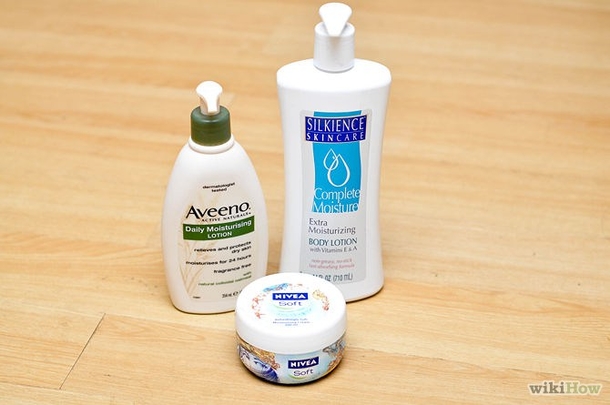
The width and height of the screenshot is (610, 405). I want to click on wood surface, so click(512, 304).